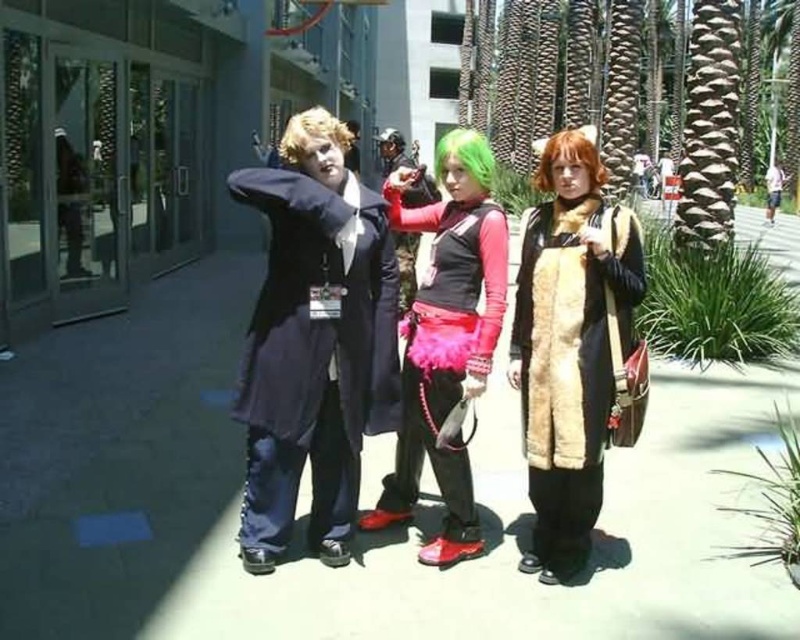
Is point (609, 342) farther from camera compared to point (306, 134)?

Yes, it is.

You are a GUI agent. You are given a task and a screenshot of the screen. Output one action in this format:
    pyautogui.click(x=<x>, y=<y>)
    Task: Click on the fuzzy brown coat at center
    This screenshot has width=800, height=640.
    Given the screenshot: What is the action you would take?
    pyautogui.click(x=574, y=365)

Does green synthetic wig at center have a larger size compared to light brown leather jacket at center?

Indeed, green synthetic wig at center has a larger size compared to light brown leather jacket at center.

Between point (440, 170) and point (776, 177), which one is positioned in front?

Point (440, 170)

Find the location of a particular element. green synthetic wig at center is located at coordinates (466, 156).

In the scene shown: Is paved concrete sidewalk at center to the right of blondehairwig at center from the viewer's perspective?

Yes, paved concrete sidewalk at center is to the right of blondehairwig at center.

Can you confirm if paved concrete sidewalk at center is positioned to the left of blondehairwig at center?

Incorrect, paved concrete sidewalk at center is not on the left side of blondehairwig at center.

Measure the distance between paved concrete sidewalk at center and camera.

paved concrete sidewalk at center and camera are 2.61 meters apart.

Identify the location of paved concrete sidewalk at center. The image size is (800, 640). (x=360, y=536).